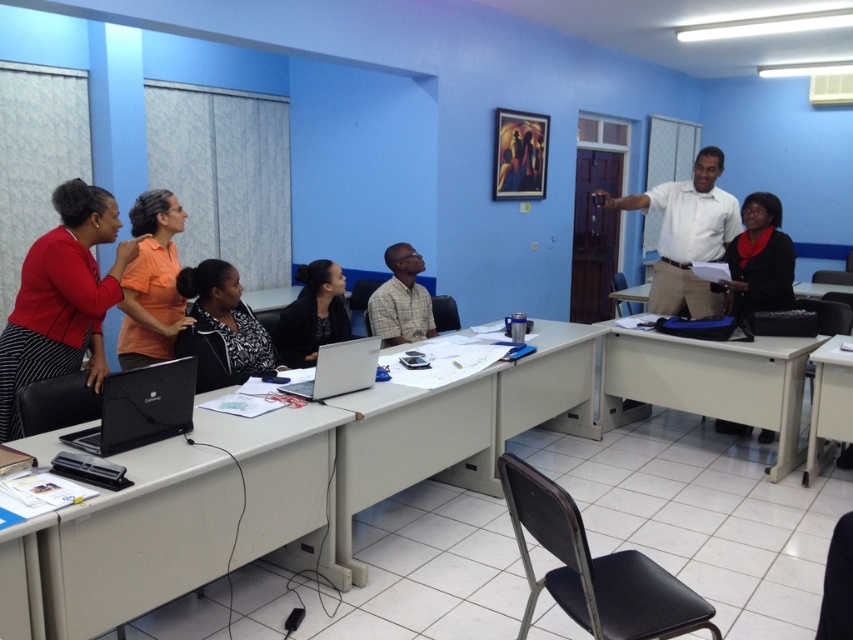
In the scene shown: Measure the distance between white laminate table at lower left and white plastic table at lower right.

The distance of white laminate table at lower left from white plastic table at lower right is 9.62 feet.

Between white laminate table at lower left and white plastic table at lower right, which one is positioned higher?

white plastic table at lower right is higher up.

Locate an element on the screen. white laminate table at lower left is located at coordinates (192, 516).

The image size is (853, 640). In order to click on white laminate table at lower left in this screenshot , I will do `click(192, 516)`.

Between white matte table at right and black matte jacket at center, which one appears on the right side from the viewer's perspective?

Positioned to the right is white matte table at right.

Is white matte table at right taller than black matte jacket at center?

Correct, white matte table at right is much taller as black matte jacket at center.

Find the location of a particular element. white matte table at right is located at coordinates (709, 381).

Between black matte laptop at lower left and black matte jacket at center, which one is positioned lower?

black matte laptop at lower left

Between point (161, 420) and point (343, 330), which one is positioned in front?

Point (161, 420) is in front.

This screenshot has height=640, width=853. I want to click on black matte laptop at lower left, so click(x=140, y=408).